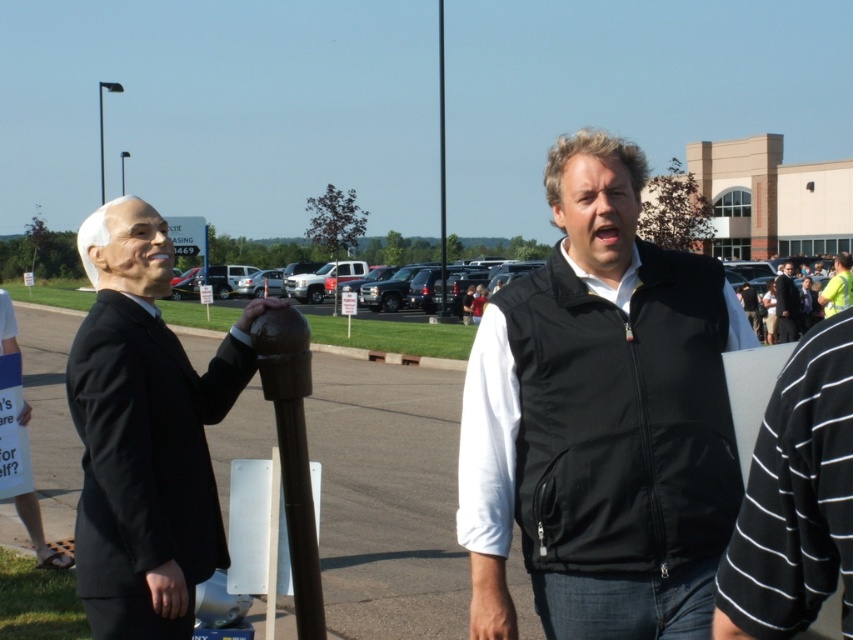
Question: Can you confirm if black softshell vest at center is positioned above matte black suit at left?

Choices:
 (A) no
 (B) yes

Answer: (B)

Question: Is black softshell vest at center behind black suit at center?

Choices:
 (A) no
 (B) yes

Answer: (A)

Question: Which point is farther to the camera?

Choices:
 (A) dark gray asphalt parking lot at center
 (B) matte black suit at left

Answer: (B)

Question: Which of the following is the farthest from the observer?

Choices:
 (A) (190, 483)
 (B) (688, 394)

Answer: (A)

Question: Which of the following is the farthest from the observer?

Choices:
 (A) (70, 353)
 (B) (792, 272)

Answer: (B)

Question: Can you confirm if brown wooden pole at center is smaller than black suit at center?

Choices:
 (A) yes
 (B) no

Answer: (B)